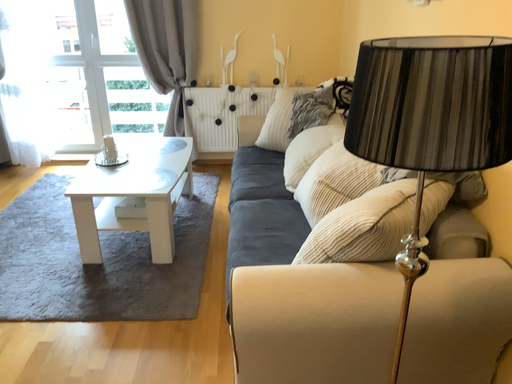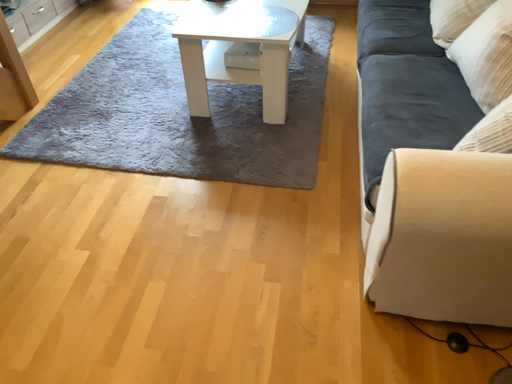
Question: Which way did the camera rotate in the video?

Choices:
 (A) rotated downward
 (B) rotated upward

Answer: (A)